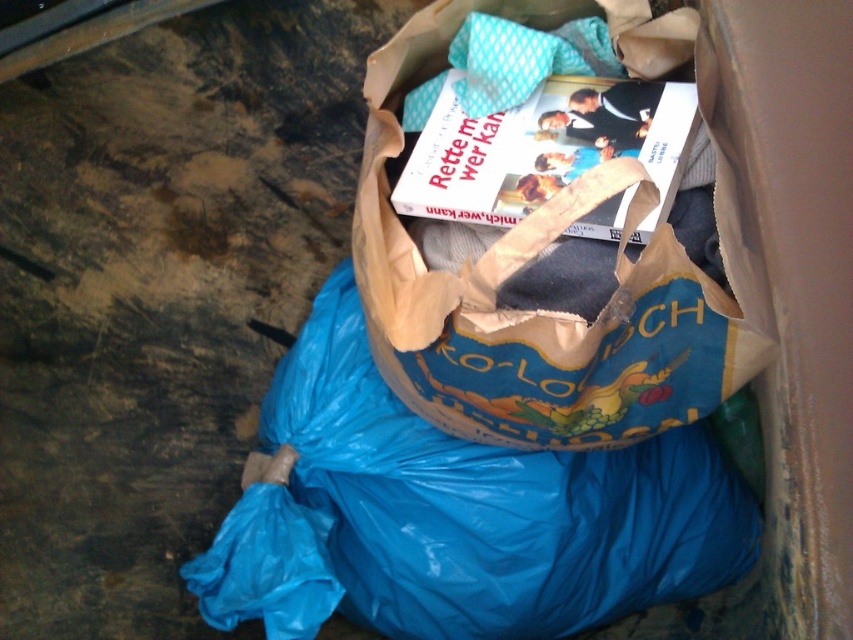
You are standing next to a trash bin and want to retrieve an item located at point (408, 284). The item is 3.39 feet away from you. If your reach extends 3 feet, can you grab it without moving closer?

The item at point (408, 284) is 3.39 feet away from you, which is beyond your 3 feet reach. You need to move closer to grab it.

You are organizing items in a trash bin and see the blue paper bag at center and the white paper book at center. Which item takes up more space in the bin?

The blue paper bag at center has a larger size compared to the white paper book at center, so it takes up more space in the bin.

You are trying to find the blue paper bag at center inside the trash bin. Based on the coordinates provided, where exactly would you look within the container?

The blue paper bag at center is located at point [532,310], so you should look near the center area of the container to find it.